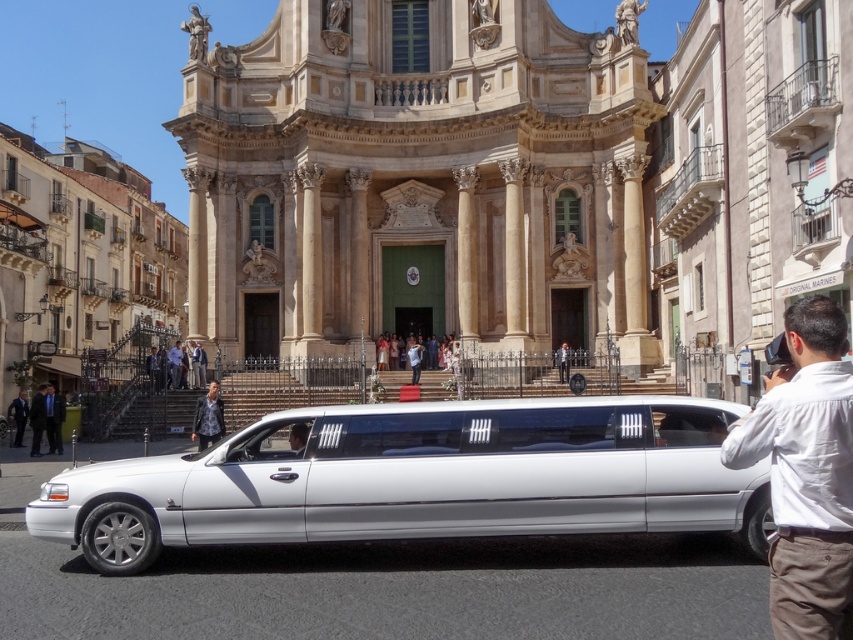
Question: Is white cotton shirt at lower right to the left of smooth black hair at center from the viewer's perspective?

Choices:
 (A) no
 (B) yes

Answer: (A)

Question: Which point is closer to the camera?

Choices:
 (A) dark suit at left
 (B) dark blue textured coat at center
 (C) smooth black hair at center

Answer: (C)

Question: Among these objects, which one is farthest from the camera?

Choices:
 (A) dark suit at lower left
 (B) white cotton shirt at lower right
 (C) beige stone cathedral at center

Answer: (C)

Question: Does dark blue textured coat at center have a lesser width compared to smooth black hair at center?

Choices:
 (A) no
 (B) yes

Answer: (A)

Question: Which point is closer to the camera?

Choices:
 (A) dark suit at left
 (B) dark suit at lower left

Answer: (B)

Question: Is beige stone cathedral at center thinner than white cotton shirt at lower right?

Choices:
 (A) no
 (B) yes

Answer: (A)